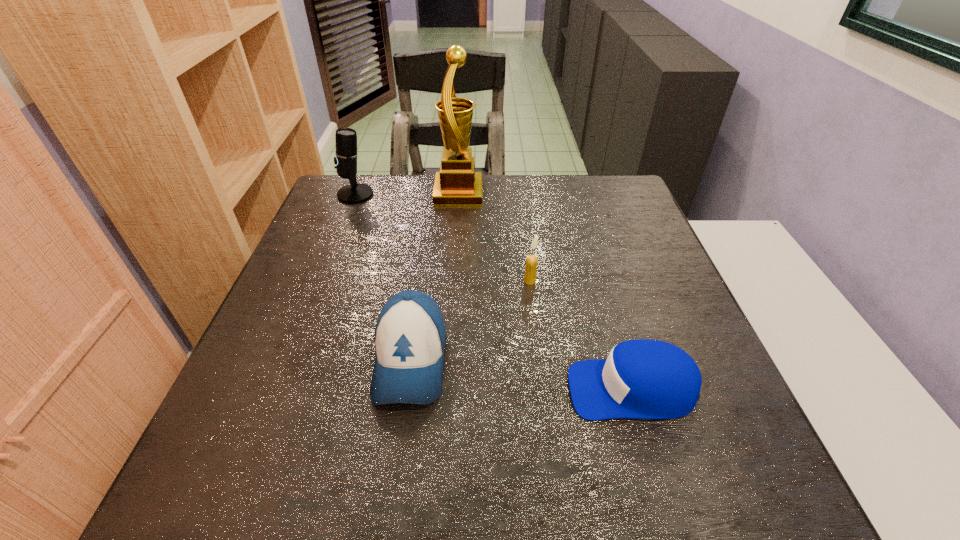
Locate an element on the screen. This screenshot has height=540, width=960. free space that satisfies the following two spatial constraints: 1. on the back side of the third farthest object; 2. on the front-facing side of the award is located at coordinates (519, 193).